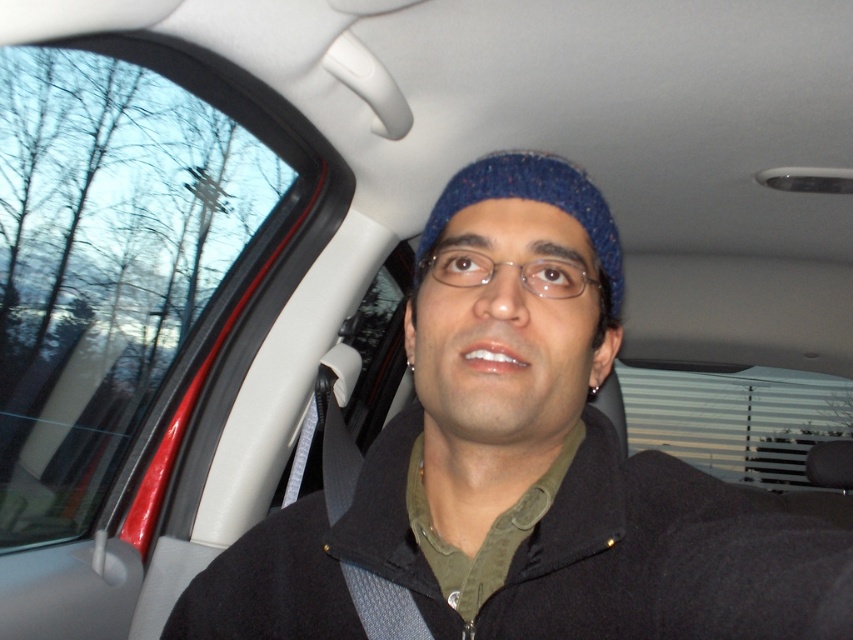
You are a passenger in the car and want to look outside through the transparent glass window at upper left while wearing the blue knitted hat at center. Can you see the window clearly without moving your head?

The transparent glass window at upper left is taller than the blue knitted hat at center, so you can see the window clearly without moving your head because the window is taller and likely provides an unobstructed view.

You are a delivery person who needs to check the weather outside through the transparent glass window at upper left while wearing the blue knitted hat at center. Can you see the entire sky outside through the window without moving your head?

The transparent glass window at upper left is wider than blue knitted hat at center, so yes, you can see the entire sky outside through the window without moving your head.